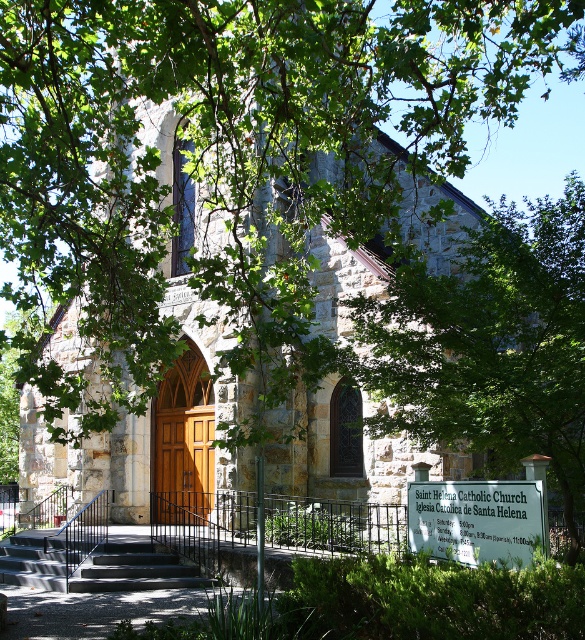
You are standing in front of the Saint Helena Catholic Church and notice two points marked on the facade. The first point is at coordinates point (x=256, y=84), and the second is at point (x=452, y=307). Which point is closer to you?

Point (x=256, y=84) is further to the viewer than point (x=452, y=307). Therefore, the point closer to you is point (x=452, y=307).

You are standing at the entrance of the stone church at center and want to see if the dark gray concrete stairs at center can fit entirely within the width of the church. Can they?

The stone church at center might be wider than dark gray concrete stairs at center, so there is a possibility that the dark gray concrete stairs at center can fit within the church width, but the exact dimensions are uncertain.

You are standing in front of the stone church at center and want to take a photo of it without the green leafy tree at lower right blocking the view. Based on their positions, can you move to a position where the tree is out of the frame?

The stone church at center is closer to the viewer than the green leafy tree at lower right, so moving closer to the church or adjusting your angle could position the tree out of the frame.